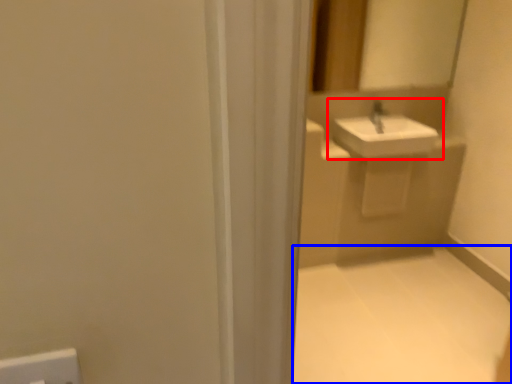
Question: Which of the following is the farthest to the observer, sink (highlighted by a red box) or plain (highlighted by a blue box)?

Choices:
 (A) sink
 (B) plain

Answer: (A)